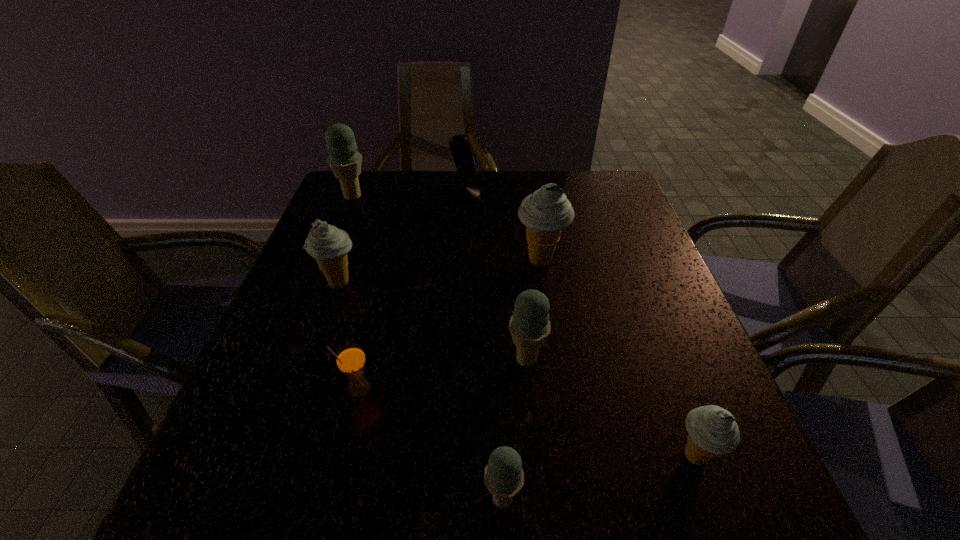
The image size is (960, 540). What are the coordinates of `vacant area at the right edge` in the screenshot? It's located at (675, 406).

In the image, there is a desktop. Where is `free space at the far left corner`? The height and width of the screenshot is (540, 960). free space at the far left corner is located at coordinates (365, 172).

The width and height of the screenshot is (960, 540). Find the location of `vacant space at the far right corner of the desktop`. vacant space at the far right corner of the desktop is located at coordinates (613, 172).

Locate an element on the screen. free space at the near right corner of the desktop is located at coordinates (774, 505).

You are a GUI agent. You are given a task and a screenshot of the screen. Output one action in this format:
    pyautogui.click(x=<x>, y=<y>)
    Task: Click on the free point between the smallest blue ice cream and the second beige icecream from right to left
    
    Given the screenshot: What is the action you would take?
    point(521,380)

At what (x,y) coordinates should I click in order to perform the action: click on free space between the second beige icecream from right to left and the nearest ice cream. Please return your answer as a coordinate pair (x, y). The height and width of the screenshot is (540, 960). Looking at the image, I should click on (521, 380).

Where is `free space between the second beige icecream from left to right and the nearest ice cream`? This screenshot has width=960, height=540. free space between the second beige icecream from left to right and the nearest ice cream is located at coordinates coord(521,380).

The image size is (960, 540). In order to click on vacant area that lies between the smallest beige icecream and the second smallest beige icecream in this screenshot , I will do `click(517, 370)`.

Locate an element on the screen. This screenshot has height=540, width=960. vacant space that's between the second beige icecream from left to right and the farthest blue ice cream is located at coordinates (446, 228).

Locate an element on the screen. empty space that is in between the third nearest object and the farthest blue ice cream is located at coordinates (356, 293).